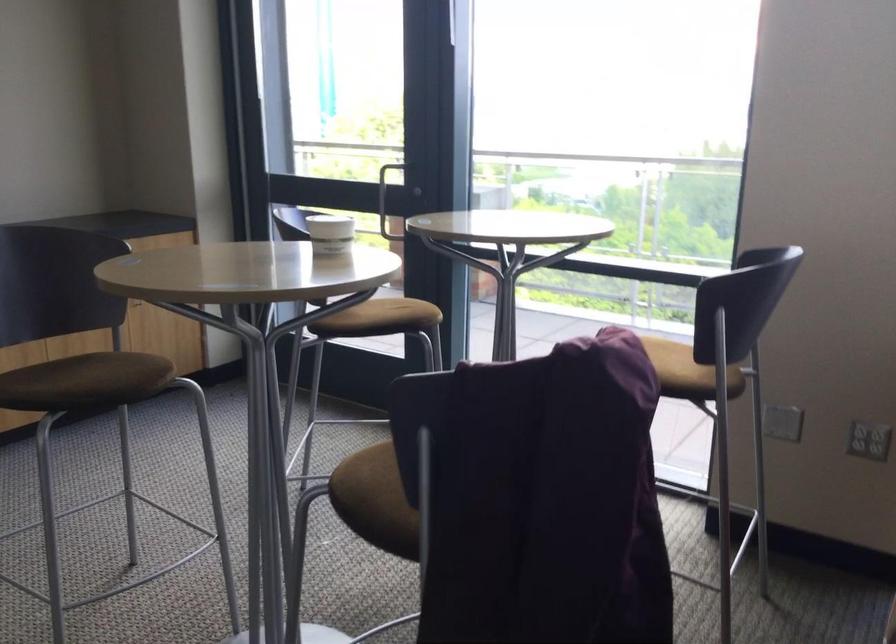
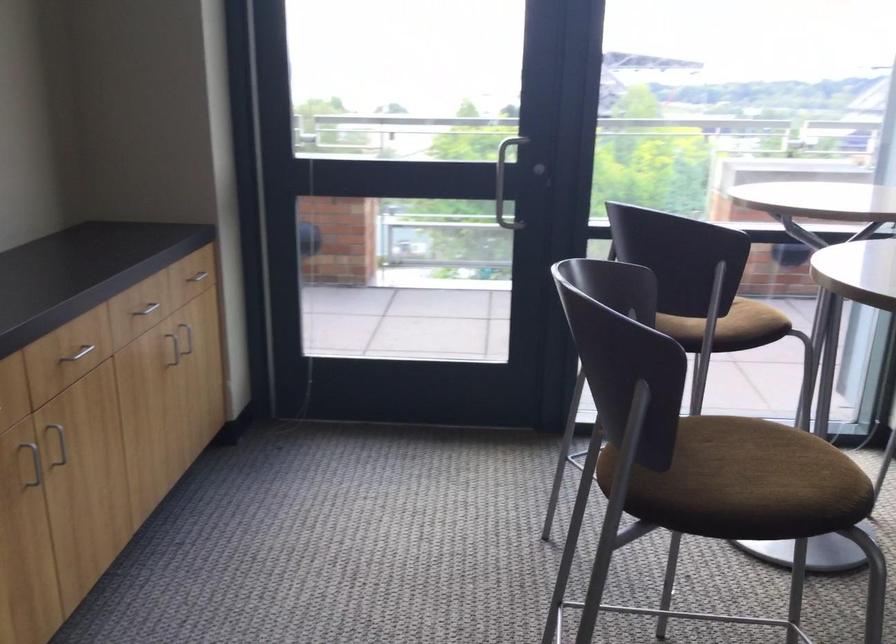
Locate, in the second image, the point that corresponds to pixel 234 243 in the first image.

(194, 279)